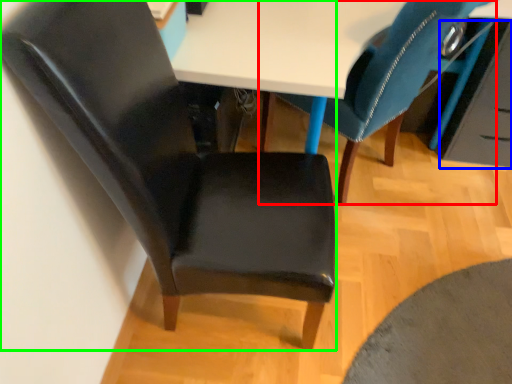
Question: Which is nearer to the chair (highlighted by a red box)? drawer (highlighted by a blue box) or chair (highlighted by a green box).

Choices:
 (A) drawer
 (B) chair

Answer: (A)